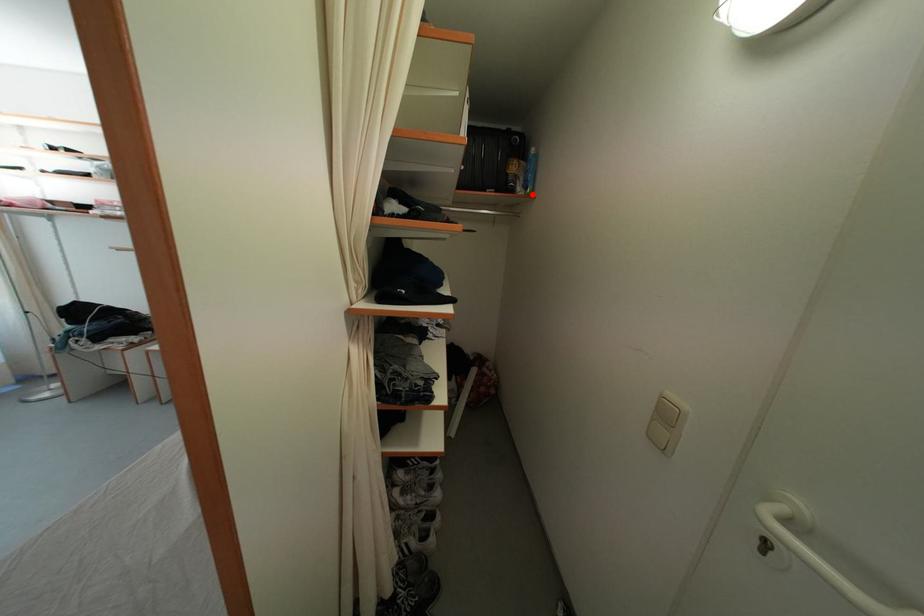
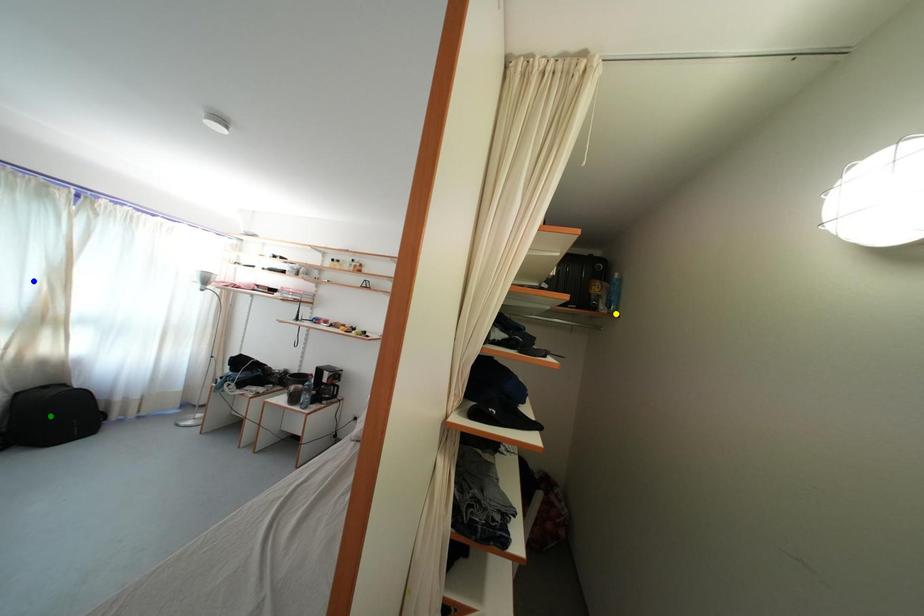
Question: I am providing you with two images of the same scene from different viewpoints. A red point is marked on the first image. You are given multiple points on the second image. Which spot in image 2 lines up with the point in image 1?

Choices:
 (A) blue point
 (B) yellow point
 (C) green point

Answer: (B)